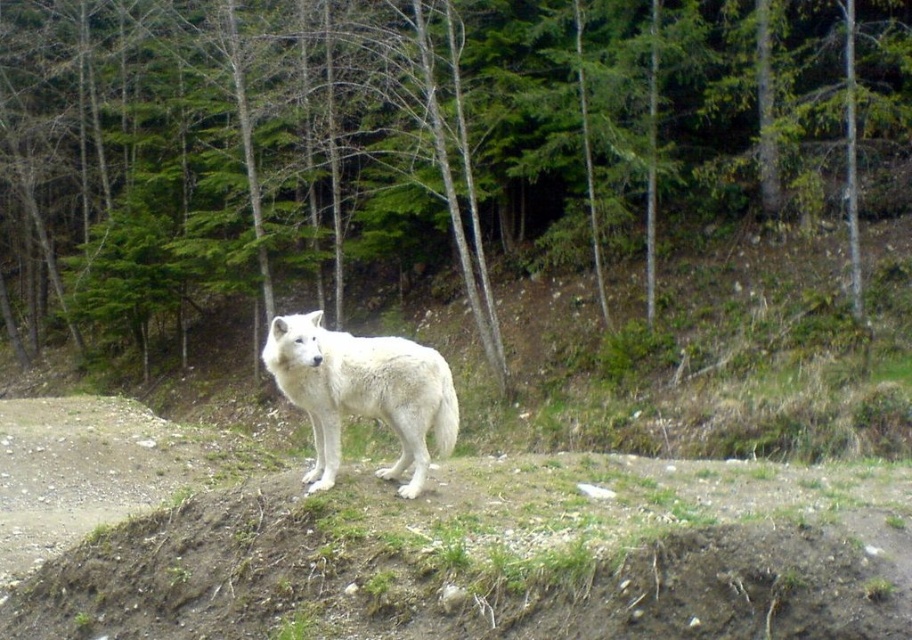
Question: Which object appears closest to the camera in this image?

Choices:
 (A) green leafy tree at center
 (B) white fur wolf at center

Answer: (B)

Question: Can you confirm if green leafy tree at center is positioned to the right of white fur wolf at center?

Choices:
 (A) no
 (B) yes

Answer: (A)

Question: Does green leafy tree at center appear under white fur wolf at center?

Choices:
 (A) yes
 (B) no

Answer: (B)

Question: Among these objects, which one is nearest to the camera?

Choices:
 (A) white fur wolf at center
 (B) green leafy tree at center

Answer: (A)

Question: Which point is farther to the camera?

Choices:
 (A) white fur wolf at center
 (B) green leafy tree at center

Answer: (B)

Question: Can you confirm if green leafy tree at center is positioned above white fur wolf at center?

Choices:
 (A) no
 (B) yes

Answer: (B)